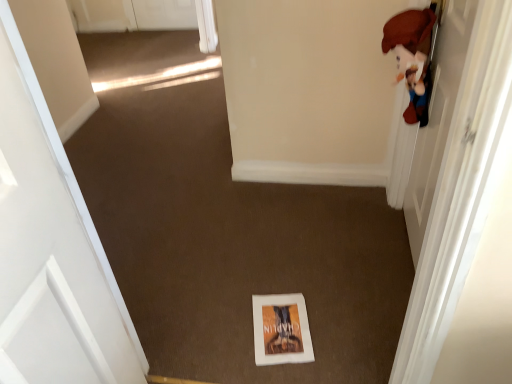
Locate an element on the screen. The height and width of the screenshot is (384, 512). free spot behind white paper book at center is located at coordinates (279, 279).